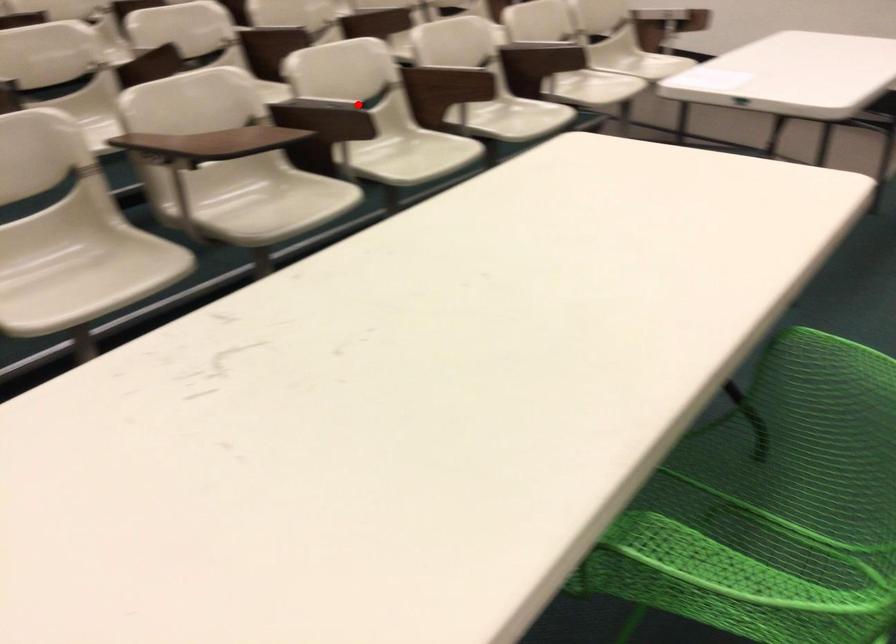
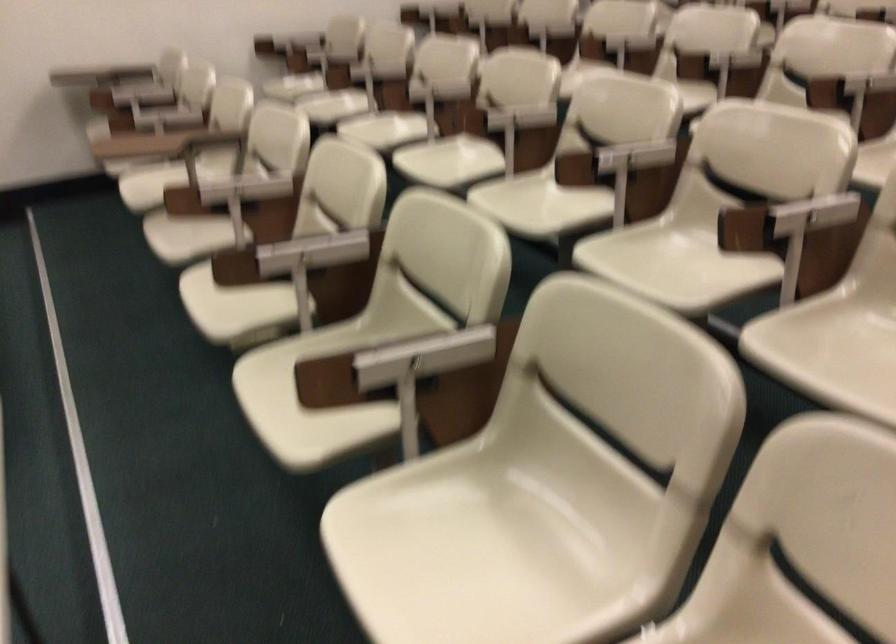
Where in the second image is the point corresponding to the highlighted location from the first image?

(229, 191)